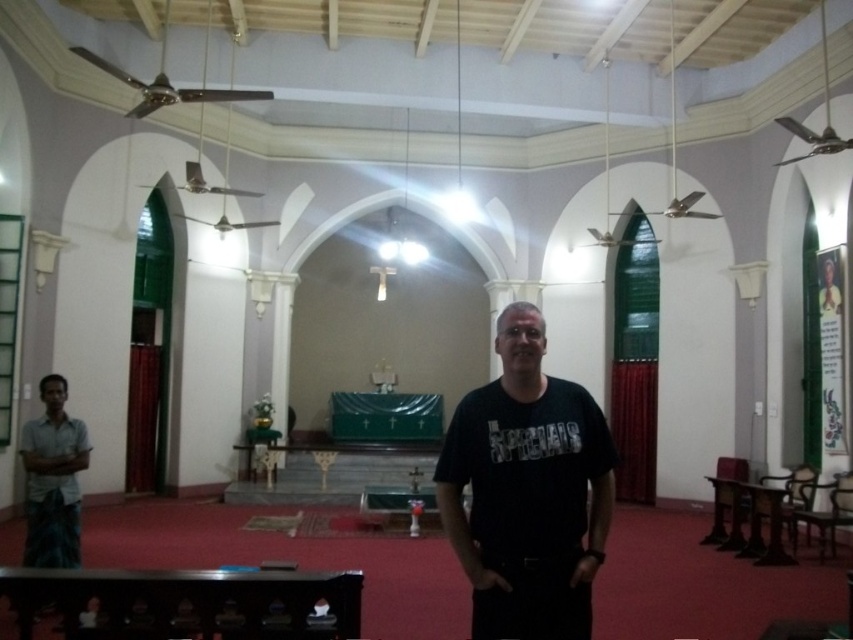
Question: Observing the image, what is the correct spatial positioning of black matte t-shirt at center in reference to light gray fabric shirt at left?

Choices:
 (A) above
 (B) below

Answer: (A)

Question: Does black matte t-shirt at center appear on the right side of light gray fabric shirt at left?

Choices:
 (A) no
 (B) yes

Answer: (B)

Question: Is black matte t-shirt at center wider than light gray fabric shirt at left?

Choices:
 (A) no
 (B) yes

Answer: (B)

Question: Which of the following is the closest to the observer?

Choices:
 (A) light gray fabric shirt at left
 (B) black matte t-shirt at center

Answer: (B)